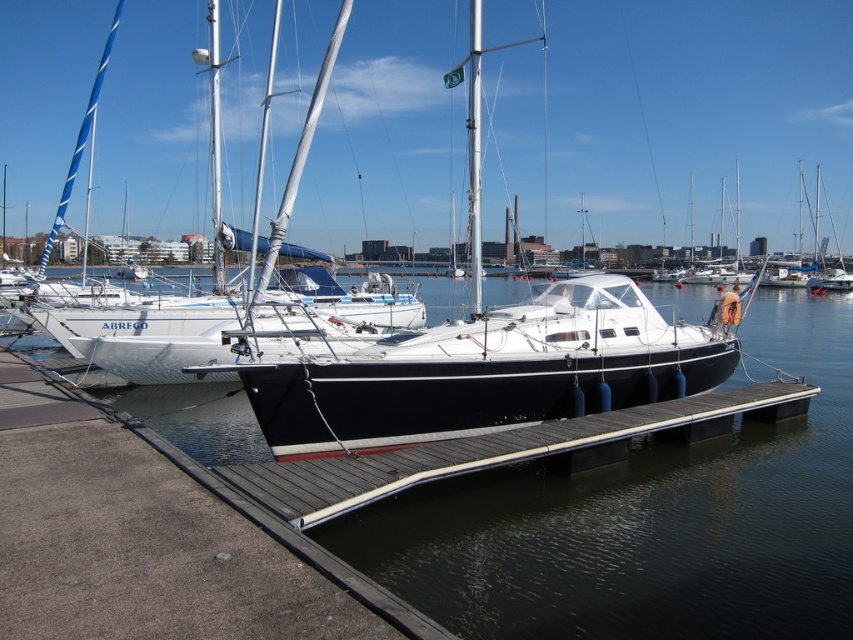
Image resolution: width=853 pixels, height=640 pixels. Describe the element at coordinates (489, 372) in the screenshot. I see `white glossy sailboat at center` at that location.

Does point (564, 368) come behind point (508, 444)?

Yes.

Find the location of `white glossy sailboat at center`. white glossy sailboat at center is located at coordinates (489, 372).

Can you confirm if transparent water at center is wider than smooth wood dock at center?

Correct, the width of transparent water at center exceeds that of smooth wood dock at center.

This screenshot has width=853, height=640. Describe the element at coordinates (648, 522) in the screenshot. I see `transparent water at center` at that location.

Identify the location of transparent water at center. The image size is (853, 640). (648, 522).

Is point (560, 628) more distant than point (546, 321)?

No, it is not.

Does transparent water at center have a lesser height compared to white glossy sailboat at center?

No, transparent water at center is not shorter than white glossy sailboat at center.

Image resolution: width=853 pixels, height=640 pixels. In order to click on transparent water at center in this screenshot , I will do tap(648, 522).